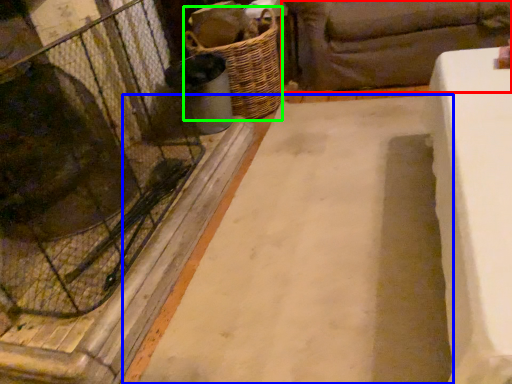
Question: Estimate the real-world distances between objects in this image. Which object is farther from studio couch (highlighted by a red box), foundation (highlighted by a blue box) or basket (highlighted by a green box)?

Choices:
 (A) foundation
 (B) basket

Answer: (A)